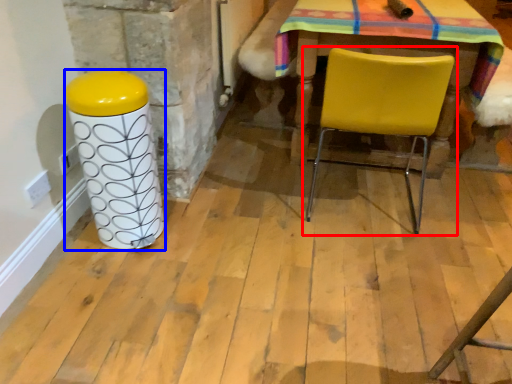
Question: Which of the following is the farthest to the observer, chair (highlighted by a red box) or pillar (highlighted by a blue box)?

Choices:
 (A) chair
 (B) pillar

Answer: (A)